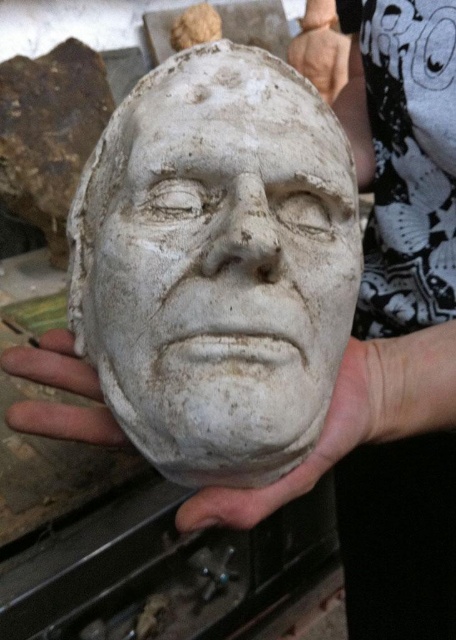
Looking at this image, you are a sculptor working on a delicate plaster cast. You need to place your hands in such a way that they are exactly 8 inches apart to ensure stability. Given the positions of the white matte hand at center and the gray matte hand at lower left shown in the image, will this placement work for your requirement?

The distance between the white matte hand at center and the gray matte hand at lower left is 7.94 inches, which is just slightly less than the required 8 inches. Therefore, this placement may not provide the exact stability needed for your requirement.

You are an art conservator examining the plaster cast. You notice two hands holding it. Which hand is positioned closer to you, the white matte hand at center or the gray matte hand at lower left?

The white matte hand at center is closer to the viewer than the gray matte hand at lower left.

You are an art conservator assessing the condition of the white clay mask at center and the gray matte hand at lower left. Which object is wider according to the description?

The white clay mask at center might be wider than gray matte hand at lower left.